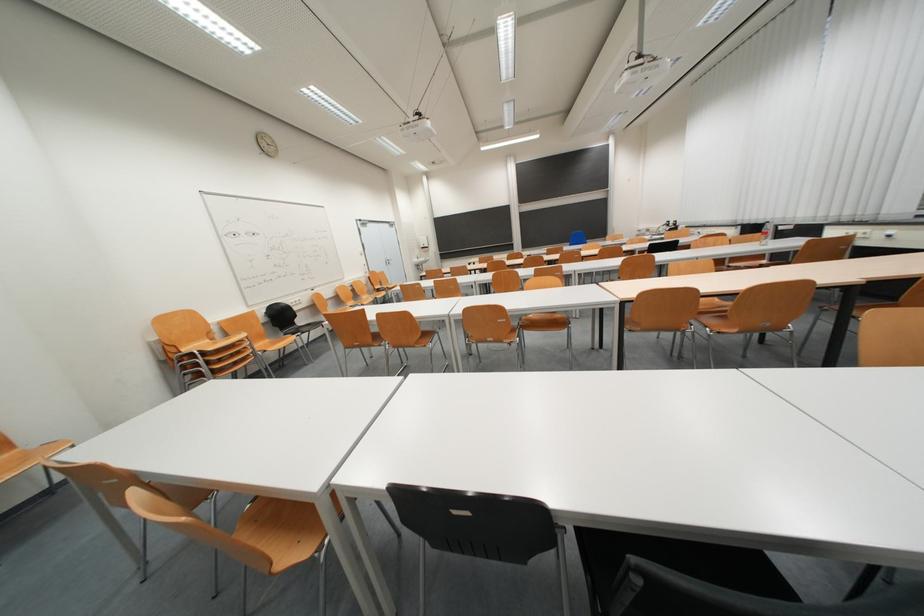
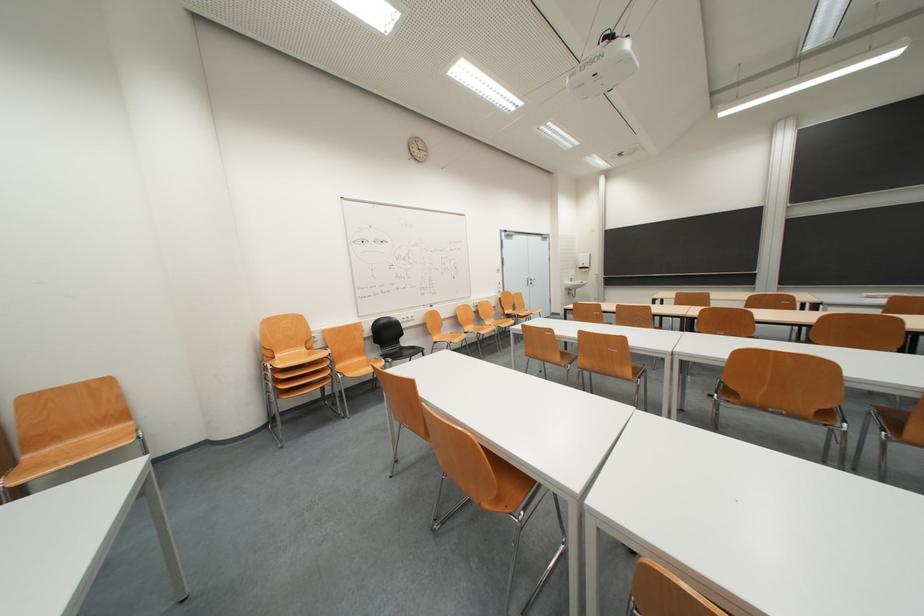
Locate, in the second image, the point that corresponds to (422,265) in the first image.

(575, 288)